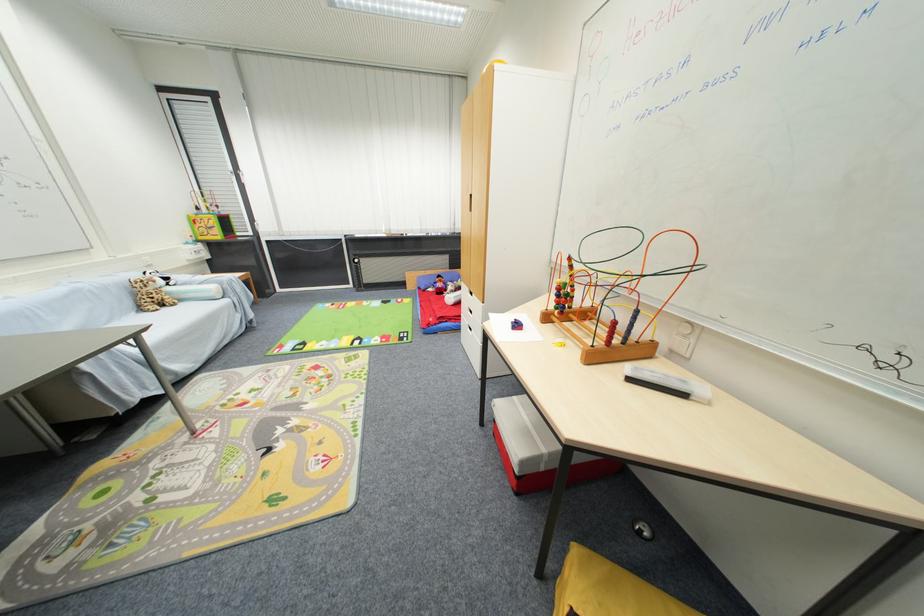
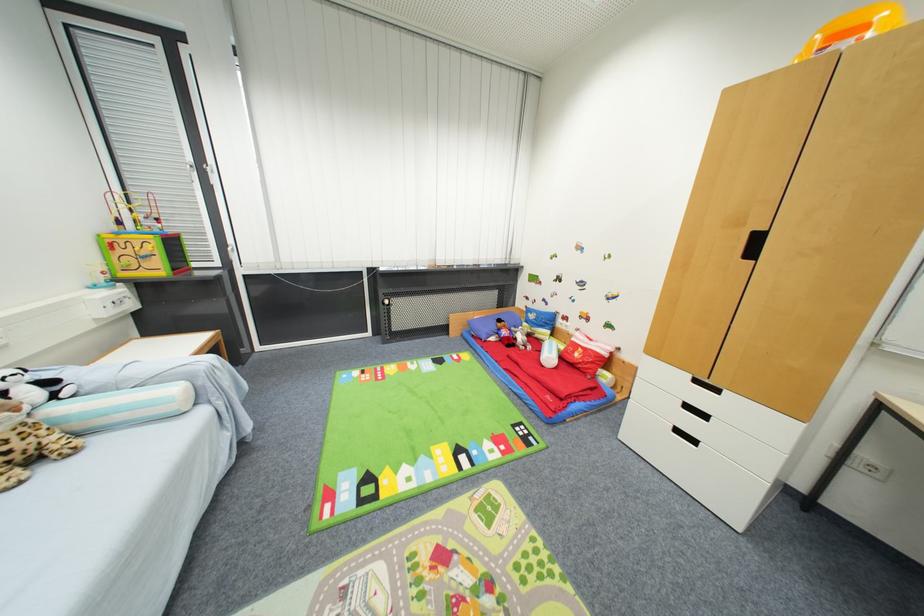
Which direction would the cameraman need to move to produce the second image?

The cameraman walked toward left, forward.